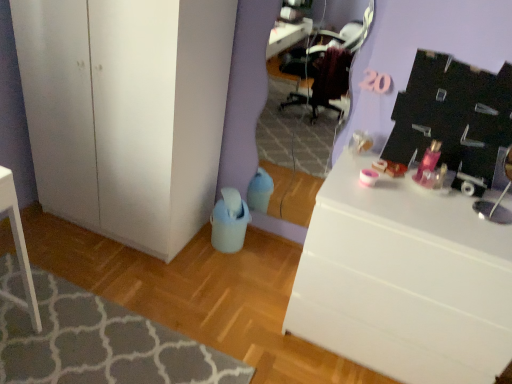
Locate an element on the screen. The height and width of the screenshot is (384, 512). free spot in front of white matte cabinet at lower left is located at coordinates (118, 275).